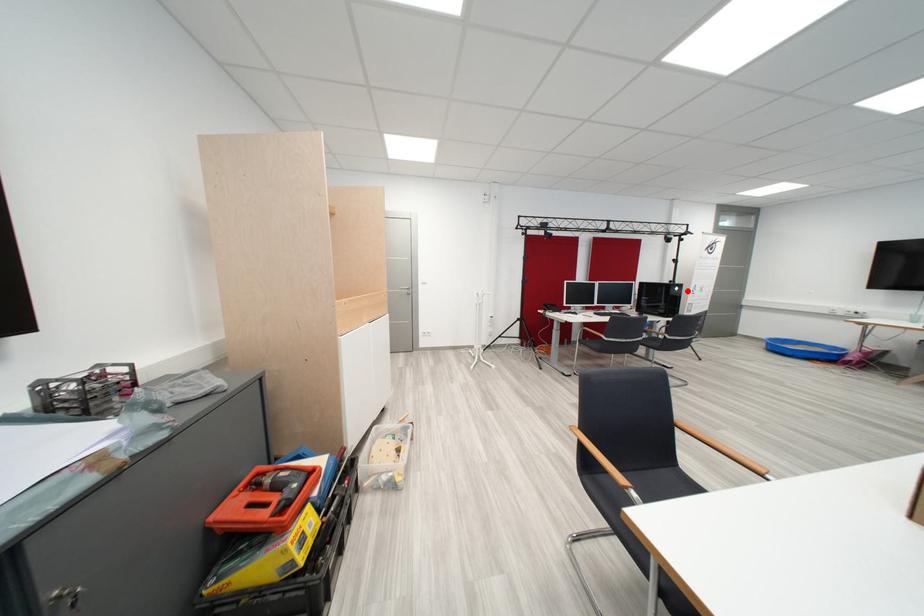
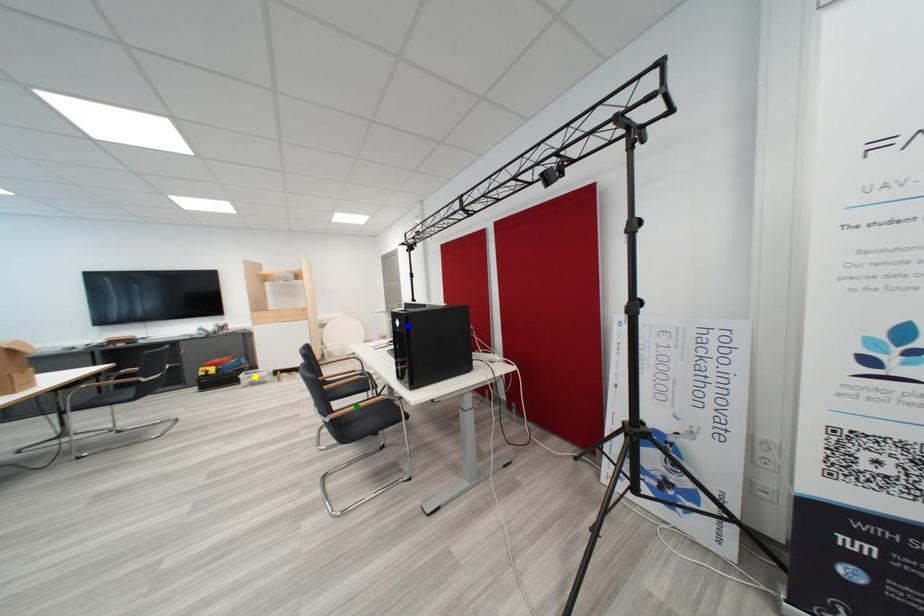
Question: I am providing you with two images of the same scene from different viewpoints. A red point is marked on the first image. You are given multiple points on the second image. Which mark in image 2 goes with the point in image 1?

Choices:
 (A) green point
 (B) blue point
 (C) yellow point

Answer: (B)